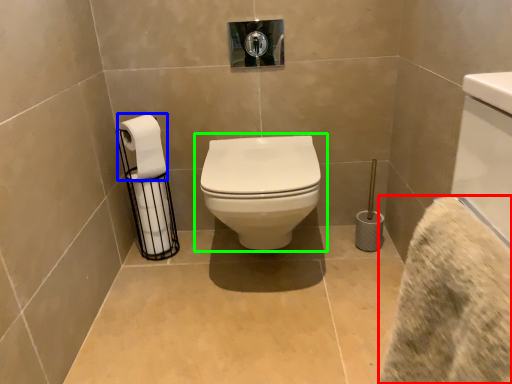
Question: Which object is the closest to the bath towel (highlighted by a red box)? Choose among these: toilet paper (highlighted by a blue box) or toilet (highlighted by a green box).

Choices:
 (A) toilet paper
 (B) toilet

Answer: (B)